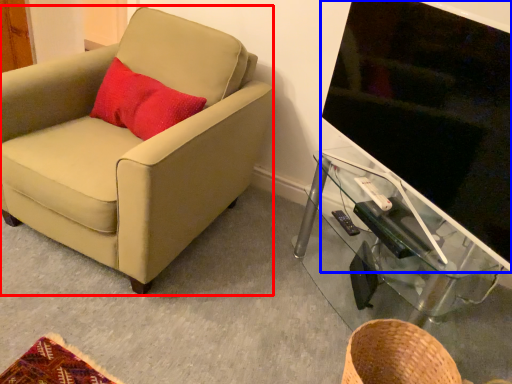
Question: Which of the following is the closest to the observer, chair (highlighted by a red box) or television (highlighted by a blue box)?

Choices:
 (A) chair
 (B) television

Answer: (B)